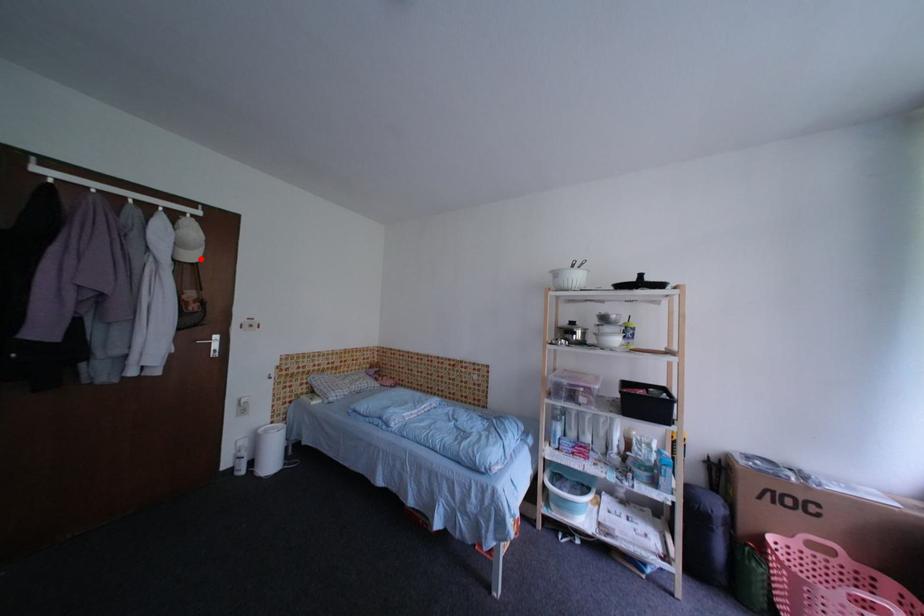
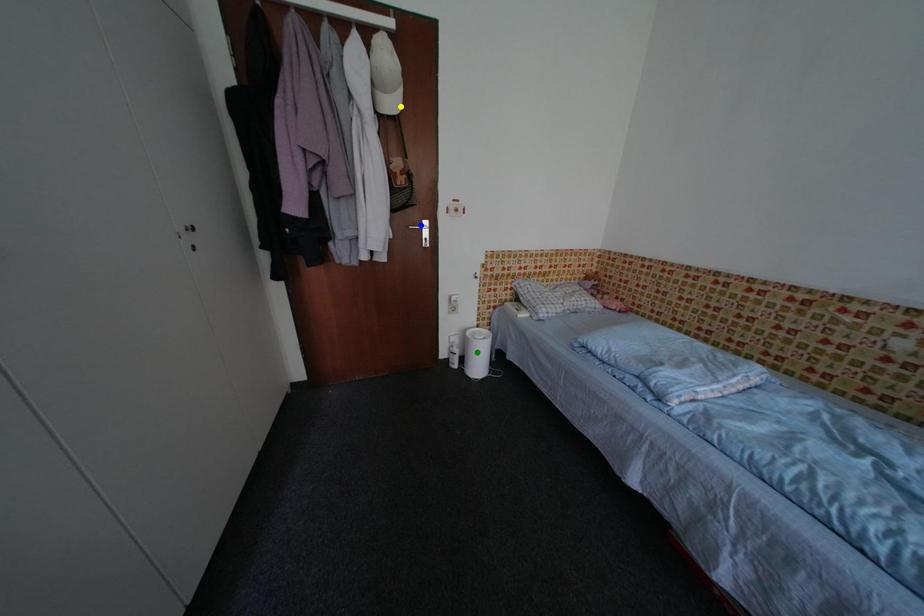
Question: I am providing you with two images of the same scene from different viewpoints. A red point is marked on the first image. You are given multiple points on the second image. Which spot in image 2 lines up with the point in image 1?

Choices:
 (A) yellow point
 (B) green point
 (C) blue point

Answer: (A)